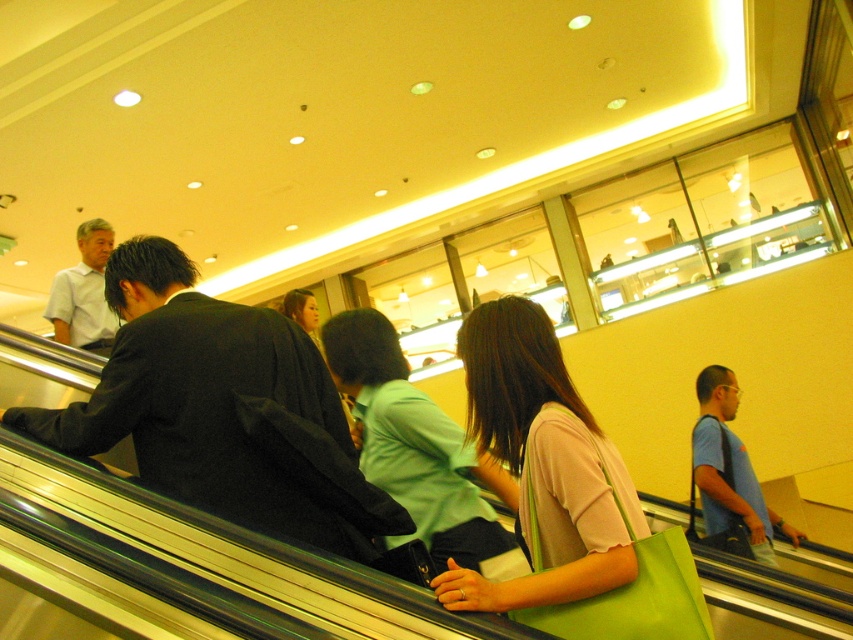
Consider the image. Who is positioned more to the left, black matte jacket at left or pink fabric bag at center?

From the viewer's perspective, black matte jacket at left appears more on the left side.

Identify the location of black matte jacket at left. This screenshot has height=640, width=853. (213, 404).

Between blue cotton shirt at right and white shirt at left, which one is positioned lower?

blue cotton shirt at right is below.

Can you confirm if blue cotton shirt at right is shorter than white shirt at left?

No.

Is point (732, 484) positioned in front of point (102, 273)?

Yes, point (732, 484) is closer to viewer.

Find the location of a particular element. The height and width of the screenshot is (640, 853). blue cotton shirt at right is located at coordinates (729, 468).

Does point (573, 461) come behind point (426, 458)?

That is False.

The height and width of the screenshot is (640, 853). Find the location of `pink fabric bag at center`. pink fabric bag at center is located at coordinates (541, 465).

Is point (440, 592) behind point (396, 493)?

No, it is in front of (396, 493).

This screenshot has width=853, height=640. In order to click on pink fabric bag at center in this screenshot , I will do `click(541, 465)`.